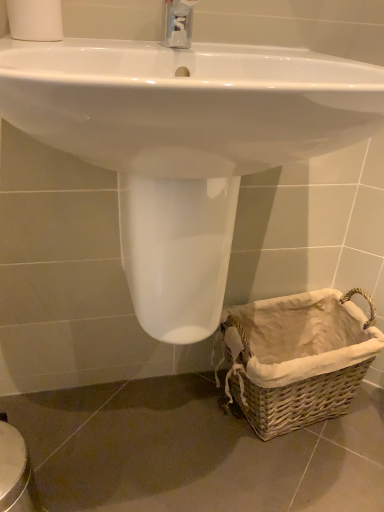
Question: Should I look upward or downward to see white matte toilet paper at upper left?

Choices:
 (A) down
 (B) up

Answer: (B)

Question: Is woven brown basket at lower right far away from white glossy sink at center?

Choices:
 (A) no
 (B) yes

Answer: (A)

Question: Is woven brown basket at lower right to the right of white glossy sink at center from the viewer's perspective?

Choices:
 (A) no
 (B) yes

Answer: (B)

Question: Does woven brown basket at lower right turn towards white glossy sink at center?

Choices:
 (A) yes
 (B) no

Answer: (B)

Question: Is woven brown basket at lower right wider than white glossy sink at center?

Choices:
 (A) no
 (B) yes

Answer: (A)

Question: Is woven brown basket at lower right smaller than white glossy sink at center?

Choices:
 (A) no
 (B) yes

Answer: (B)

Question: Is white glossy sink at center surrounded by woven brown basket at lower right?

Choices:
 (A) no
 (B) yes

Answer: (A)

Question: Is white glossy sink at center wider than woven brown basket at lower right?

Choices:
 (A) yes
 (B) no

Answer: (A)

Question: From the image's perspective, is white glossy sink at center under woven brown basket at lower right?

Choices:
 (A) yes
 (B) no

Answer: (B)

Question: From a real-world perspective, is white glossy sink at center positioned under woven brown basket at lower right based on gravity?

Choices:
 (A) no
 (B) yes

Answer: (A)

Question: Is white glossy sink at center further to the viewer compared to woven brown basket at lower right?

Choices:
 (A) yes
 (B) no

Answer: (B)

Question: Is white glossy sink at center far away from woven brown basket at lower right?

Choices:
 (A) yes
 (B) no

Answer: (B)

Question: Is white glossy sink at center turned away from woven brown basket at lower right?

Choices:
 (A) yes
 (B) no

Answer: (B)

Question: Does white matte toilet paper at upper left come behind woven brown basket at lower right?

Choices:
 (A) yes
 (B) no

Answer: (B)